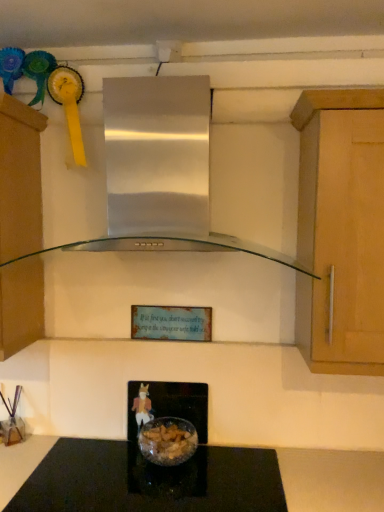
Identify the location of free point below translucent glass bowl at center (from a real-world perspective). The image size is (384, 512). 174,461.